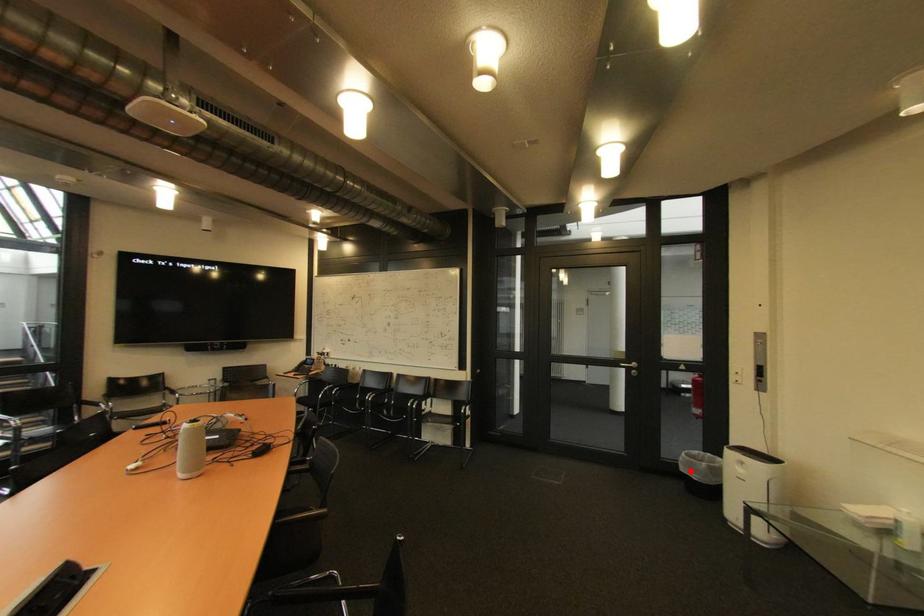
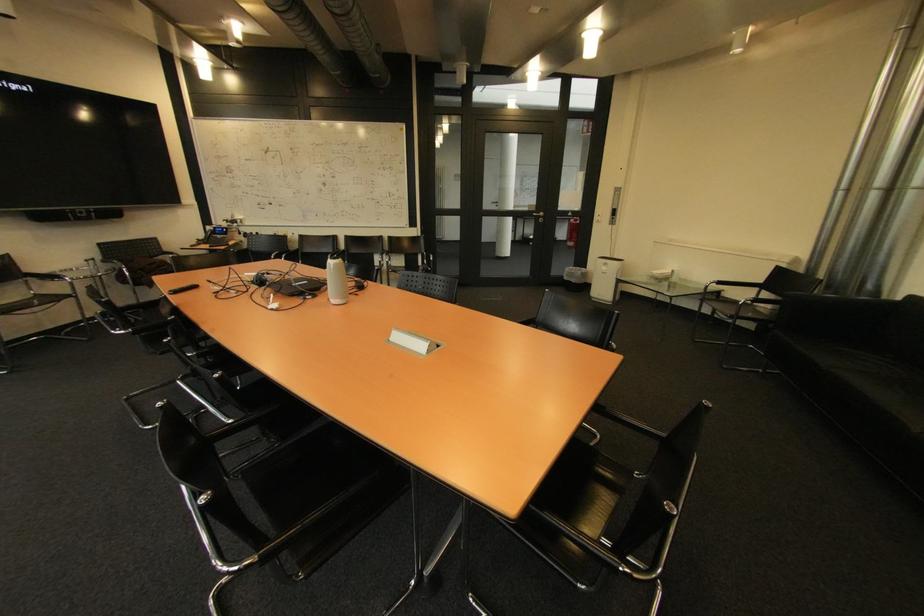
Locate, in the second image, the point that corresponds to the highlighted location in the first image.

(574, 280)